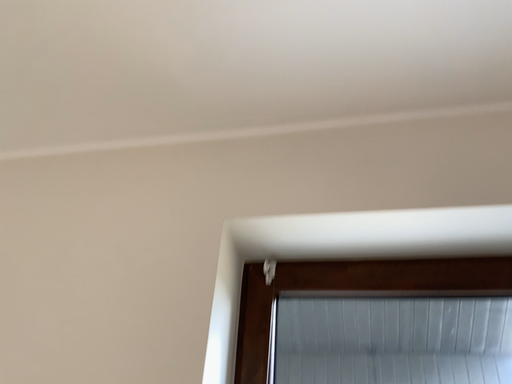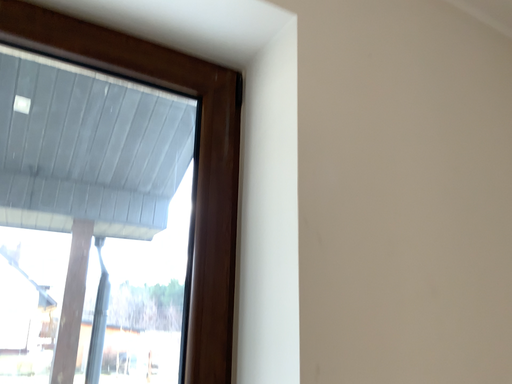
Question: How did the camera likely rotate when shooting the video?

Choices:
 (A) rotated right
 (B) rotated left

Answer: (A)